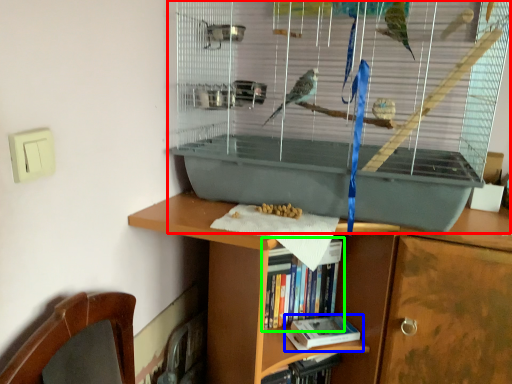
Question: Which object is positioned closest to bird cage (highlighted by a red box)? Select from book (highlighted by a blue box) and book (highlighted by a green box).

Choices:
 (A) book
 (B) book

Answer: (B)